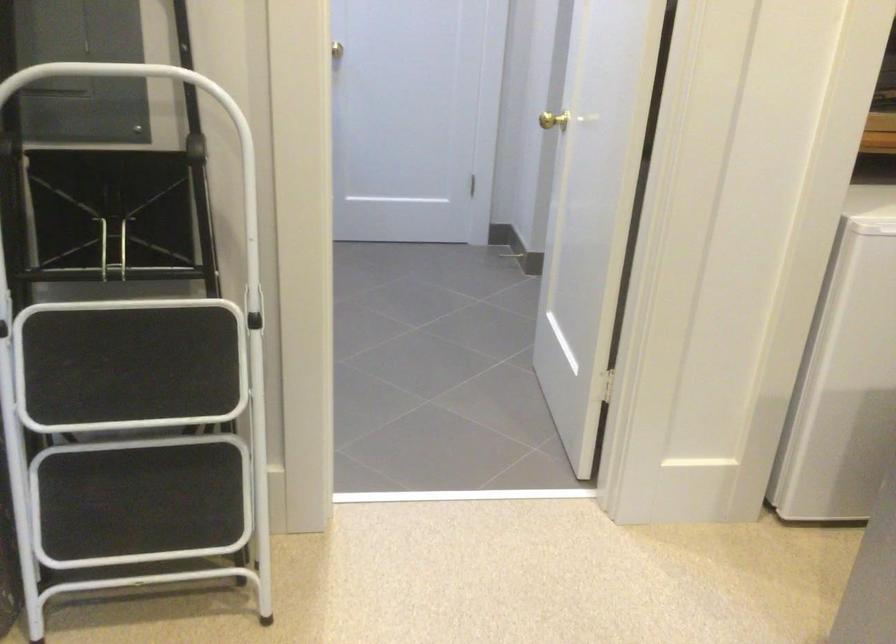
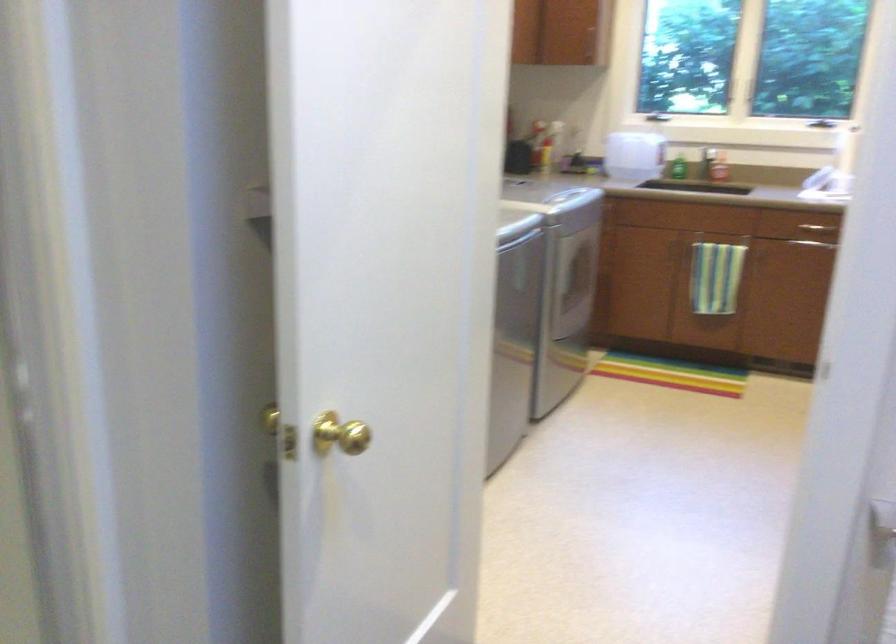
Locate, in the second image, the point that corresponds to (x=572, y=138) in the first image.

(339, 433)